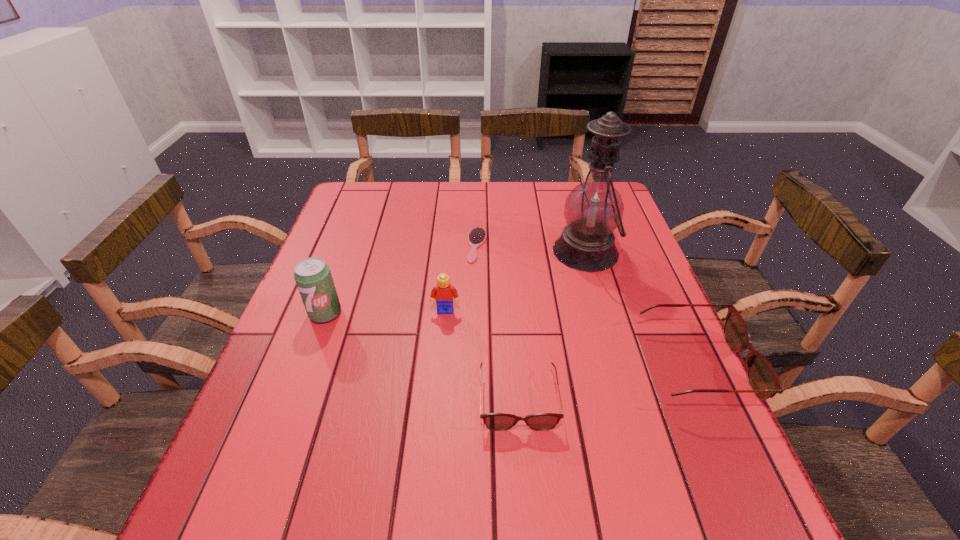
Find the location of `the left spectacles`. the left spectacles is located at coordinates (494, 421).

The height and width of the screenshot is (540, 960). I want to click on the shorter spectacles, so click(494, 421).

This screenshot has width=960, height=540. I want to click on the right spectacles, so click(763, 379).

Identify the location of the third shortest object. (763, 379).

Locate an element on the screen. The height and width of the screenshot is (540, 960). hairbrush is located at coordinates (477, 236).

You are a GUI agent. You are given a task and a screenshot of the screen. Output one action in this format:
    pyautogui.click(x=<x>, y=<y>)
    Task: Click on the oil lamp
    This screenshot has height=540, width=960.
    Given the screenshot: What is the action you would take?
    pyautogui.click(x=593, y=210)

This screenshot has height=540, width=960. In order to click on soda in this screenshot , I will do (312, 275).

The width and height of the screenshot is (960, 540). I want to click on the second tallest object, so click(x=312, y=275).

This screenshot has height=540, width=960. Identify the location of the second object from left to right. coord(443,293).

The image size is (960, 540). Identify the location of the fourth shortest object. (443, 293).